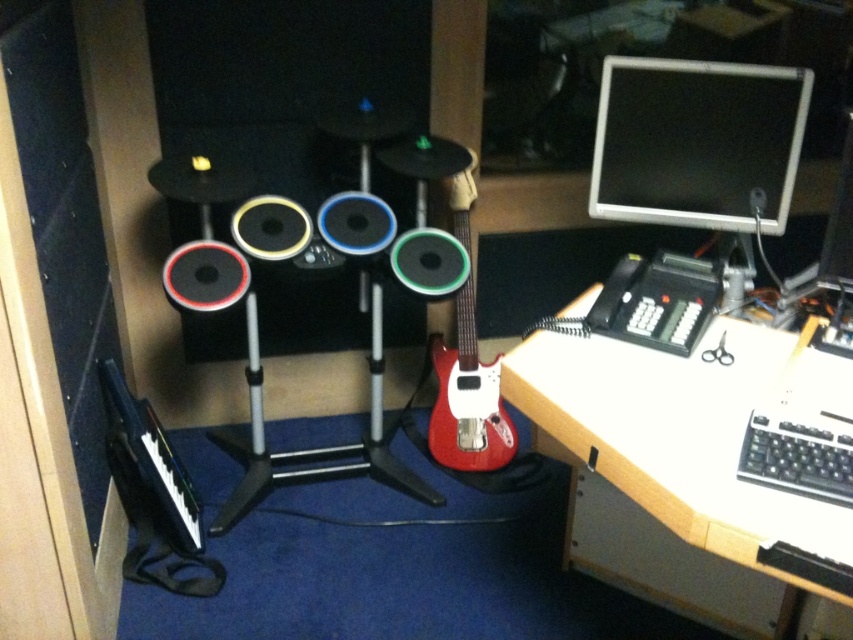
Question: Where is matte silver monitor at upper right located in relation to glossy red electric guitar at center in the image?

Choices:
 (A) left
 (B) right

Answer: (B)

Question: Which is nearer to the wooden at right?

Choices:
 (A) glossy red electric guitar at center
 (B) matte silver monitor at upper right

Answer: (B)

Question: Does matte silver monitor at upper right come in front of glossy red electric guitar at center?

Choices:
 (A) yes
 (B) no

Answer: (A)

Question: Which point is farther to the camera?

Choices:
 (A) wooden at right
 (B) matte silver monitor at upper right
 (C) glossy red electric guitar at center

Answer: (C)

Question: Which of these objects is positioned farthest from the glossy red electric guitar at center?

Choices:
 (A) wooden at right
 (B) matte silver monitor at upper right

Answer: (A)

Question: Is matte silver monitor at upper right below glossy red electric guitar at center?

Choices:
 (A) yes
 (B) no

Answer: (B)